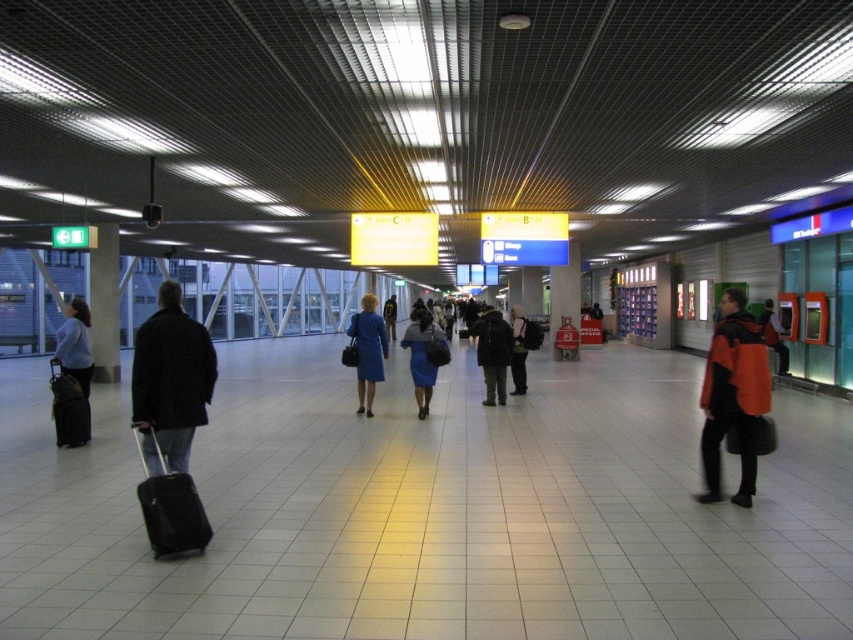
You are a traveler standing in the transportation hub and see the blue fabric skirt at center and the black fabric suitcase at left. Which item is located to the right of the other?

The blue fabric skirt at center is positioned on the right side of the black fabric suitcase at left.

You are a traveler with a 2 meter long luggage cart. You are standing at the dark matte coat at left and want to reach the exit that is straight ahead. Is there enough space between you and any nearby objects to move forward without obstacles?

The dark matte coat at left is 4.60 meters away from the nearest object, so yes, there is enough space to move forward without obstacles since the distance is greater than the length of the luggage cart.

Looking at this image, you are a traveler standing in the transportation hub and you want to check the width of your clothing items to ensure they fit in the overhead compartment. Which clothing item has a smaller width between the blue fabric skirt at center and the dark gray jacket at center?

The blue fabric skirt at center has a smaller width compared to the dark gray jacket at center, so it will fit better in the overhead compartment.